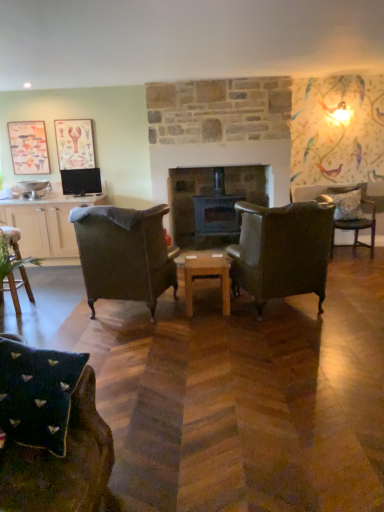
Question: Considering the positions of leather armchair at center, placed as the fourth chair when sorted from back to front, and white textured pillow at right in the image, is leather armchair at center, placed as the fourth chair when sorted from back to front, bigger or smaller than white textured pillow at right?

Choices:
 (A) small
 (B) big

Answer: (B)

Question: Relative to white textured pillow at right, is leather armchair at center, which appears as the second chair when viewed from the front, in front or behind?

Choices:
 (A) behind
 (B) front

Answer: (B)

Question: Considering the real-world distances, which object is farthest from the wooden at center?

Choices:
 (A) white textured pillow at right
 (B) dark gray stone fireplace at center
 (C) matte wooden picture frame at upper left, the first picture frame in the left-to-right sequence
 (D) dark green fabric armchair at center, the 3th chair in the right-to-left sequence
 (E) matte white cabinet at left

Answer: (C)

Question: Estimate the real-world distances between objects in this image. Which object is farther from the white textured pillow at right?

Choices:
 (A) matte wooden picture frame at upper left, the first picture frame in the left-to-right sequence
 (B) dark green fabric armchair at center, positioned as the 3th chair in left-to-right order
 (C) wooden at center
 (D) floral-patterned fabric chair at right, the fifth chair in the front-to-back sequence
 (E) wooden chair at lower left, positioned as the fourth chair in front-to-back order

Answer: (E)